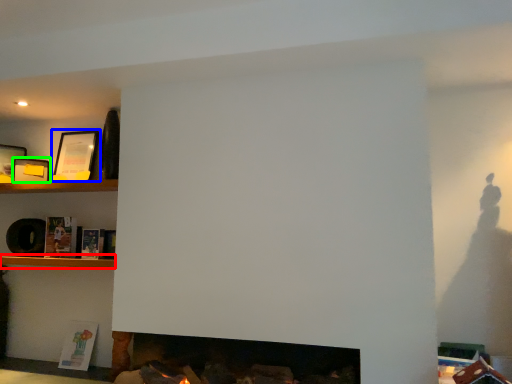
Question: Which is nearer to the shelf (highlighted by a red box)? picture frame (highlighted by a blue box) or picture frame (highlighted by a green box).

Choices:
 (A) picture frame
 (B) picture frame

Answer: (B)